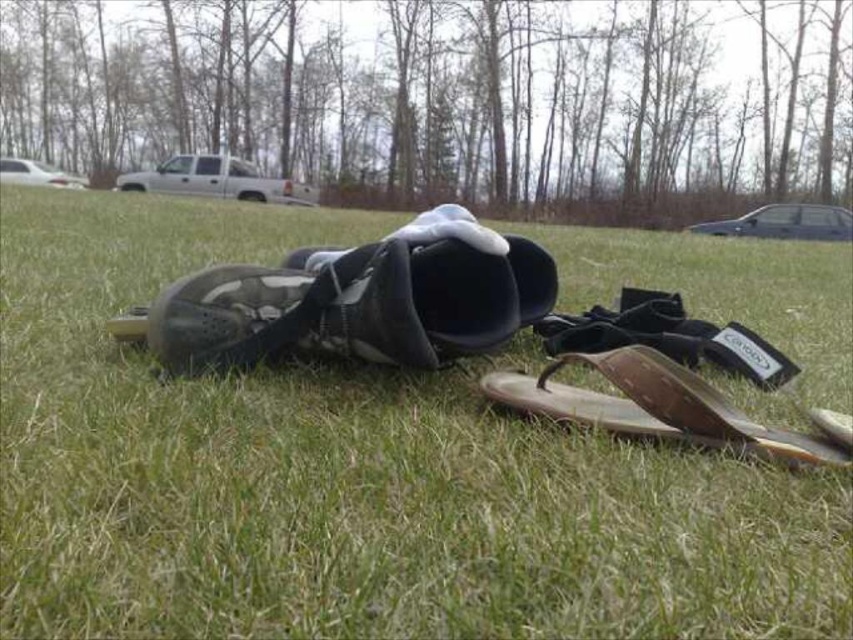
You are standing at the camera position and want to pick up an item. Which point, point (589, 401) or point (38, 180), is closer to you?

Point (589, 401) is closer to you than point (38, 180).